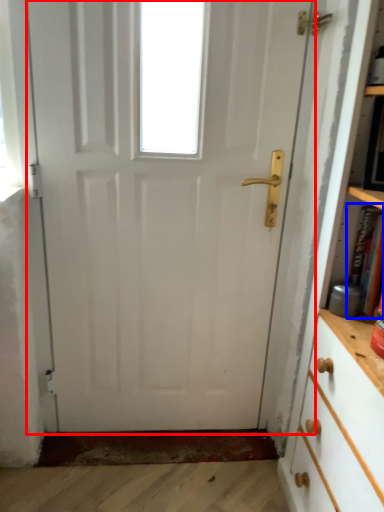
Question: Among these objects, which one is nearest to the camera, door (highlighted by a red box) or book (highlighted by a blue box)?

Choices:
 (A) door
 (B) book

Answer: (B)